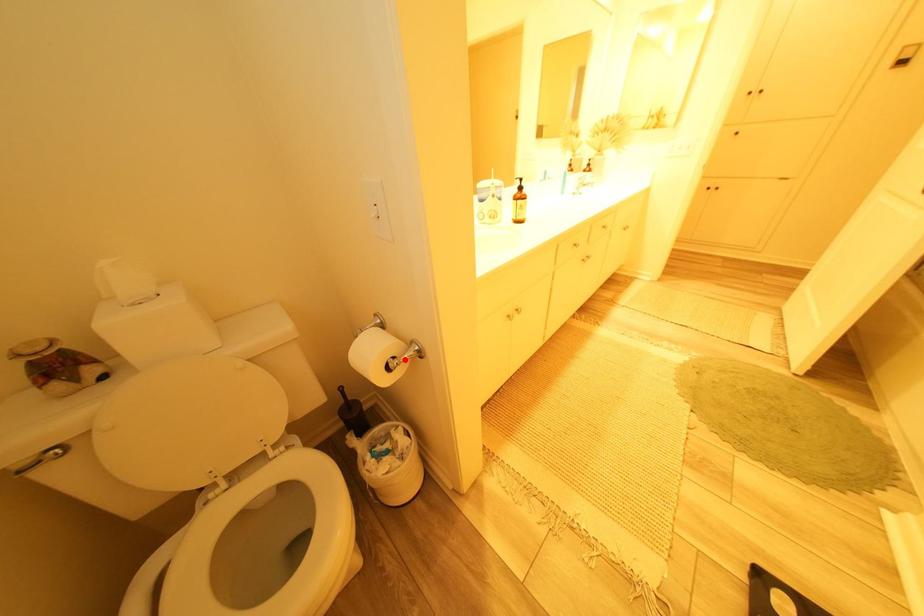
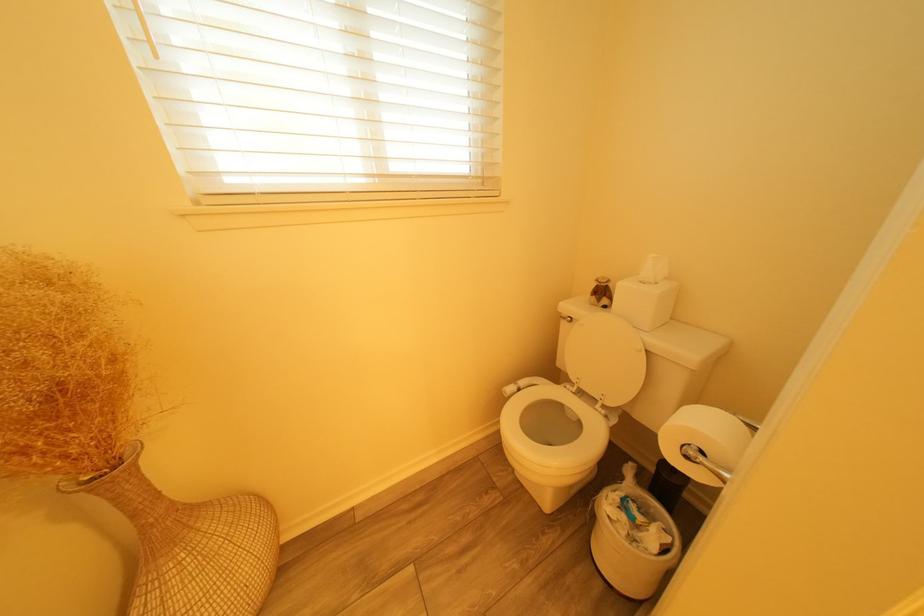
Where in the second image is the point corresponding to the highlighted location from the first image?

(712, 454)